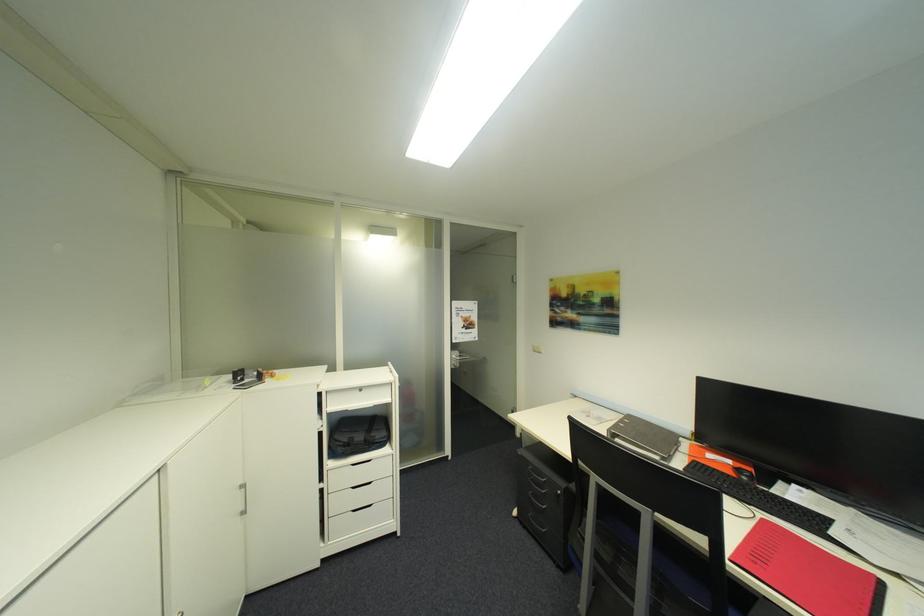
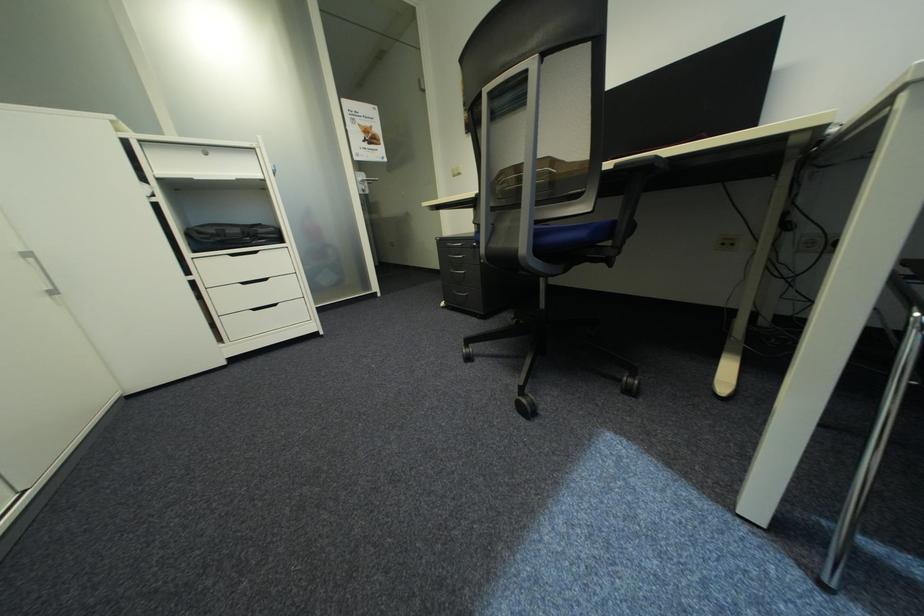
Question: I am providing you with two images of the same scene from different viewpoints. Which of the following objects are not visible in image2?

Choices:
 (A) metal bench handle
 (B) blue chair sitting surface
 (C) red notebook
 (D) white drawer handle

Answer: (C)